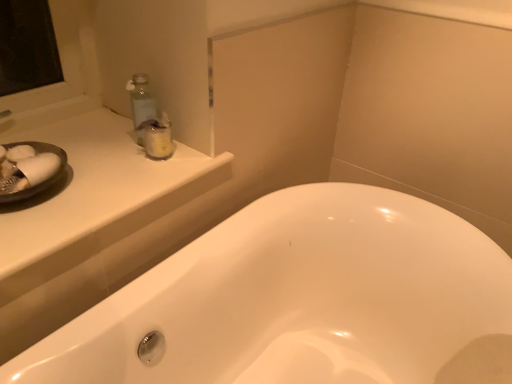
Question: From a real-world perspective, is white glossy bathtub at center over white glossy counter top at upper left?

Choices:
 (A) yes
 (B) no

Answer: (B)

Question: From a real-world perspective, does white glossy bathtub at center sit lower than white glossy counter top at upper left?

Choices:
 (A) yes
 (B) no

Answer: (A)

Question: Could you tell me if white glossy bathtub at center is facing white glossy counter top at upper left?

Choices:
 (A) no
 (B) yes

Answer: (A)

Question: Is white glossy counter top at upper left completely or partially inside white glossy bathtub at center?

Choices:
 (A) yes
 (B) no

Answer: (B)

Question: Is white glossy bathtub at center looking in the opposite direction of white glossy counter top at upper left?

Choices:
 (A) no
 (B) yes

Answer: (A)

Question: From their relative heights in the image, would you say white glossy counter top at upper left is taller or shorter than white glossy bathtub at center?

Choices:
 (A) short
 (B) tall

Answer: (A)

Question: Considering the positions of white glossy counter top at upper left and white glossy bathtub at center in the image, is white glossy counter top at upper left wider or thinner than white glossy bathtub at center?

Choices:
 (A) wide
 (B) thin

Answer: (B)

Question: In the image, is white glossy counter top at upper left on the left side or the right side of white glossy bathtub at center?

Choices:
 (A) right
 (B) left

Answer: (B)

Question: Is white glossy counter top at upper left spatially inside white glossy bathtub at center, or outside of it?

Choices:
 (A) outside
 (B) inside

Answer: (A)

Question: Is white glossy counter top at upper left spatially inside clear plastic jar at upper left, or outside of it?

Choices:
 (A) outside
 (B) inside

Answer: (A)

Question: Considering the positions of white glossy counter top at upper left and clear plastic jar at upper left in the image, is white glossy counter top at upper left taller or shorter than clear plastic jar at upper left?

Choices:
 (A) tall
 (B) short

Answer: (B)

Question: From a real-world perspective, is white glossy counter top at upper left positioned above or below clear plastic jar at upper left?

Choices:
 (A) above
 (B) below

Answer: (B)

Question: Considering the positions of white glossy counter top at upper left and clear plastic jar at upper left in the image, is white glossy counter top at upper left wider or thinner than clear plastic jar at upper left?

Choices:
 (A) wide
 (B) thin

Answer: (A)

Question: Is clear plastic jar at upper left taller or shorter than white glossy bathtub at center?

Choices:
 (A) short
 (B) tall

Answer: (A)

Question: Is clear plastic jar at upper left inside the boundaries of white glossy bathtub at center, or outside?

Choices:
 (A) inside
 (B) outside

Answer: (B)